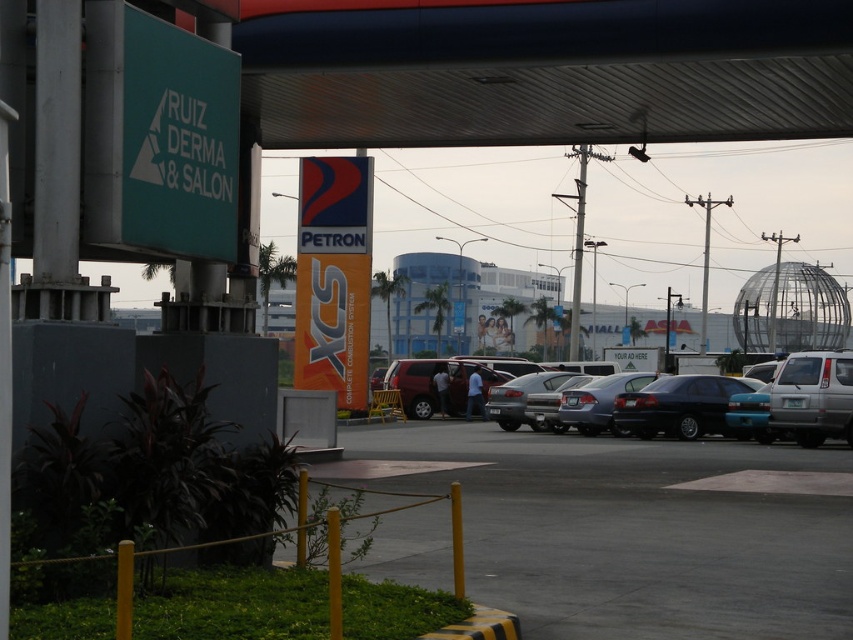
You are a delivery driver who needs to park your truck between the matte black sedan at center and the dark blue sedan at center. However, you notice that one of the sedans is blocking the other. Which sedan is blocking the other?

The matte black sedan at center is positioned over dark blue sedan at center, meaning it is blocking the dark blue sedan at center.

You are a delivery driver who needs to park your truck in the gas station. You see the smooth asphalt parking lot at lower center and the matte black sedan at center. Which one is closer to the entrance of the gas station?

The smooth asphalt parking lot at lower center is in front of the matte black sedan at center, so the parking lot is closer to the entrance than the sedan.

You are a delivery driver who needs to park your truck in the gas station. The truck is 6 meters long. You see the smooth asphalt parking lot at lower center and the matte black sedan at center. Can the parking lot accommodate your truck?

The smooth asphalt parking lot at lower center is shorter than the matte black sedan at center. Since the sedan is likely shorter than 6 meters, the parking lot would not be long enough to accommodate the truck.